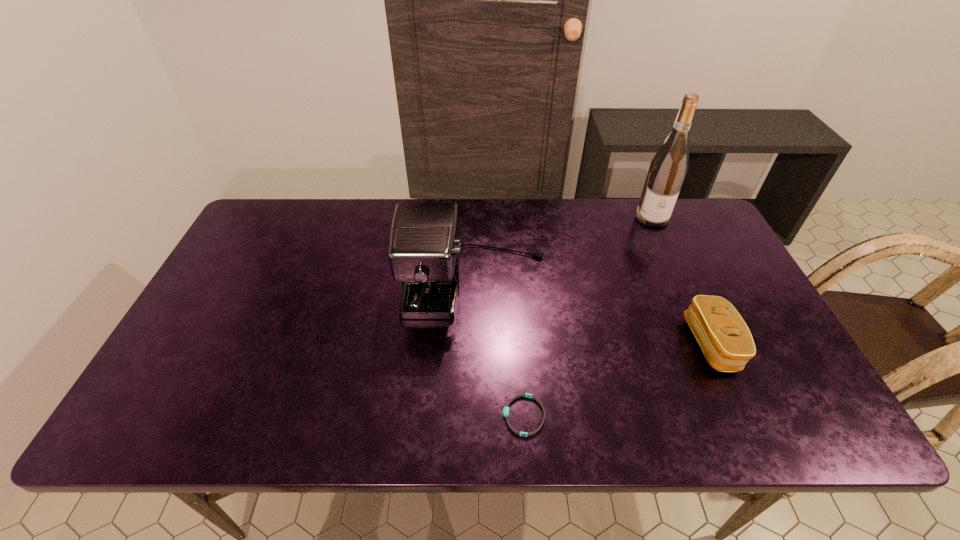
Find the location of `vacant point located on the zipper side of the second shortest object`. vacant point located on the zipper side of the second shortest object is located at coordinates (670, 344).

I want to click on vacant space located 0.130m on the buckle of the shortest object, so click(443, 415).

Where is `vacant region located 0.180m on the buckle of the shortest object`? This screenshot has width=960, height=540. vacant region located 0.180m on the buckle of the shortest object is located at coordinates (420, 415).

Where is `blank area located 0.190m on the buckle of the shortest object`? blank area located 0.190m on the buckle of the shortest object is located at coordinates (415, 415).

Identify the location of object located in the far edge section of the desktop. (667, 171).

The width and height of the screenshot is (960, 540). I want to click on object at the near edge, so click(x=506, y=409).

Where is `wine bottle that is at the right edge`? This screenshot has width=960, height=540. wine bottle that is at the right edge is located at coordinates (667, 171).

This screenshot has height=540, width=960. Find the location of `clutch bag at the right edge`. clutch bag at the right edge is located at coordinates (726, 341).

Where is `object at the far right corner`? object at the far right corner is located at coordinates (667, 171).

In the image, there is a desktop. At what (x,y) coordinates should I click in order to perform the action: click on free region at the far edge. Please return your answer as a coordinate pair (x, y). Looking at the image, I should click on (525, 211).